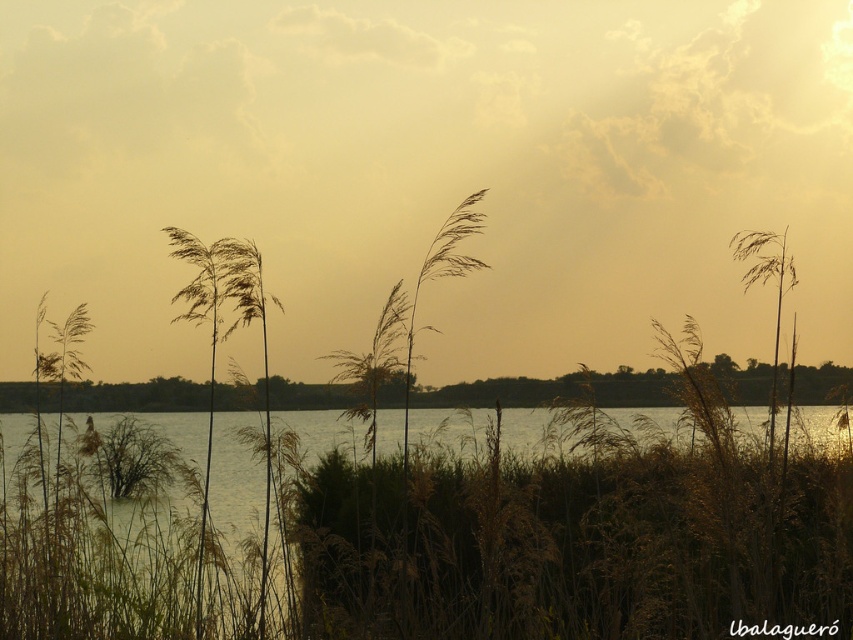
Question: Does sandy yellow cloud at upper center appear on the left side of brown dry grass at center?

Choices:
 (A) yes
 (B) no

Answer: (A)

Question: Considering the relative positions of sandy yellow cloud at upper center and brown dry grass at center in the image provided, where is sandy yellow cloud at upper center located with respect to brown dry grass at center?

Choices:
 (A) left
 (B) right

Answer: (A)

Question: Does sandy yellow cloud at upper center have a smaller size compared to brown dry grass at center?

Choices:
 (A) no
 (B) yes

Answer: (A)

Question: Which of the following is the farthest from the observer?

Choices:
 (A) sandy yellow cloud at upper center
 (B) brown dry grass at center

Answer: (A)